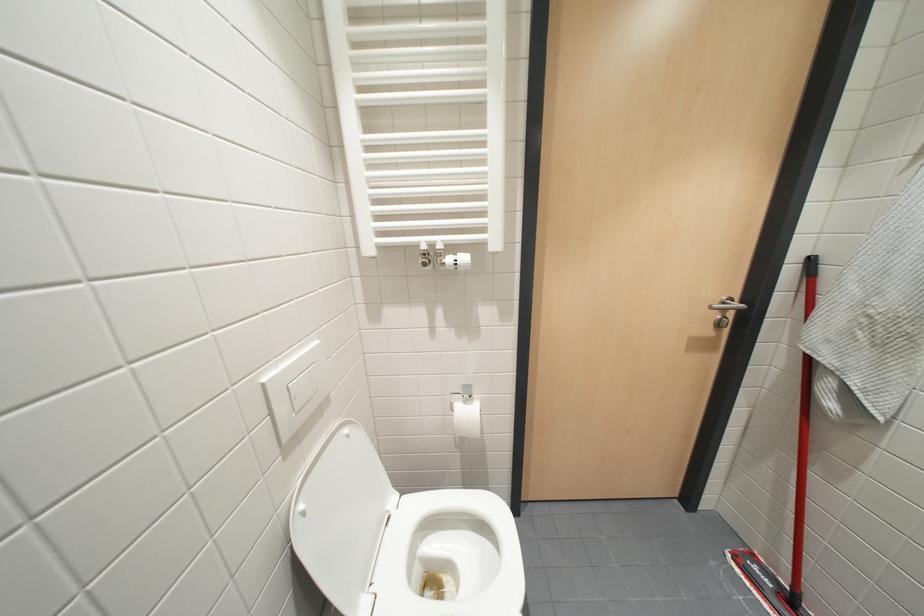
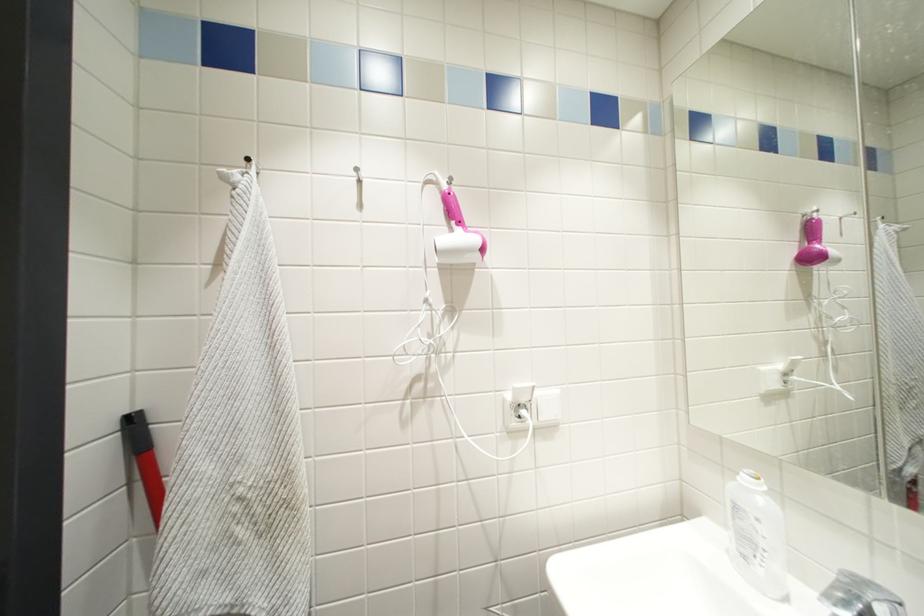
Question: The camera is either moving clockwise (left) or counter-clockwise (right) around the object. The first image is from the beginning of the video and the second image is from the end. Is the camera moving left or right when shooting the video?

Choices:
 (A) Left
 (B) Right

Answer: (A)